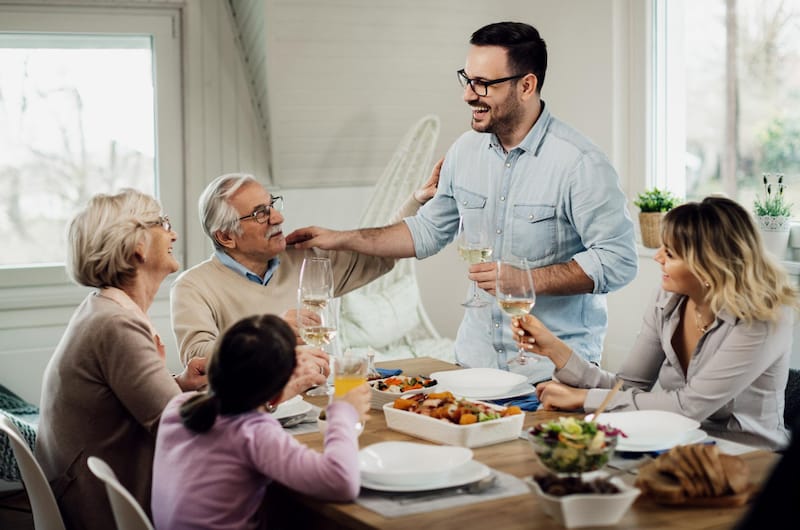
This screenshot has height=530, width=800. In order to click on food dishes in this screenshot , I will do `click(694, 475)`, `click(573, 489)`, `click(569, 432)`, `click(450, 408)`, `click(402, 384)`.